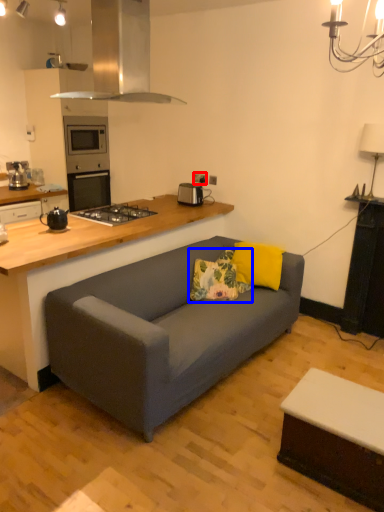
Question: Which point is further to the camera, electric outlet (highlighted by a red box) or pillow (highlighted by a blue box)?

Choices:
 (A) electric outlet
 (B) pillow

Answer: (A)